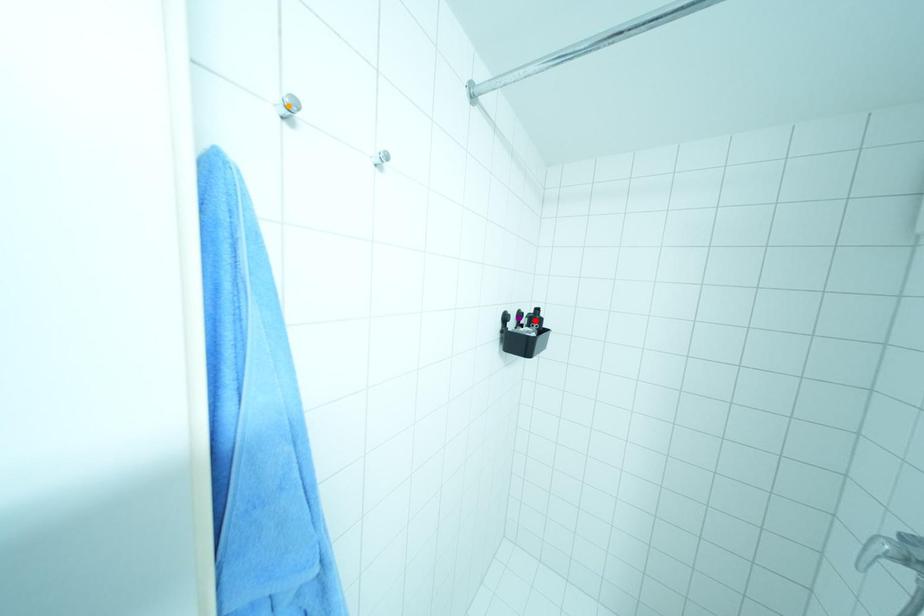
Order these from nearest to farthest:
orange point | red point | purple point

1. orange point
2. purple point
3. red point